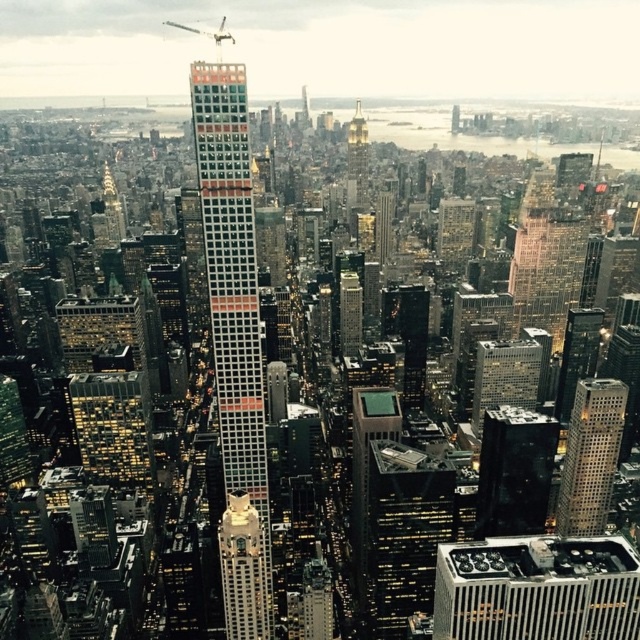
Question: Which of the following is the closest to the observer?

Choices:
 (A) (227, 580)
 (B) (356, 177)

Answer: (B)

Question: Is gold textured owl at center positioned before gold reflective spire at center?

Choices:
 (A) no
 (B) yes

Answer: (B)

Question: Among these objects, which one is nearest to the camera?

Choices:
 (A) gold reflective spire at center
 (B) glassy reflective skyscraper at center
 (C) metallic gray crane at upper center
 (D) silver metallic skyscraper at center-right

Answer: (B)

Question: Is glassy reflective skyscraper at center positioned behind metallic gray crane at upper center?

Choices:
 (A) yes
 (B) no

Answer: (B)

Question: Which object is farther from the camera taking this photo?

Choices:
 (A) white glass skyscraper at center
 (B) metallic gray crane at upper center

Answer: (B)

Question: Can you confirm if black glass building at center is smaller than gold reflective spire at center?

Choices:
 (A) no
 (B) yes

Answer: (A)